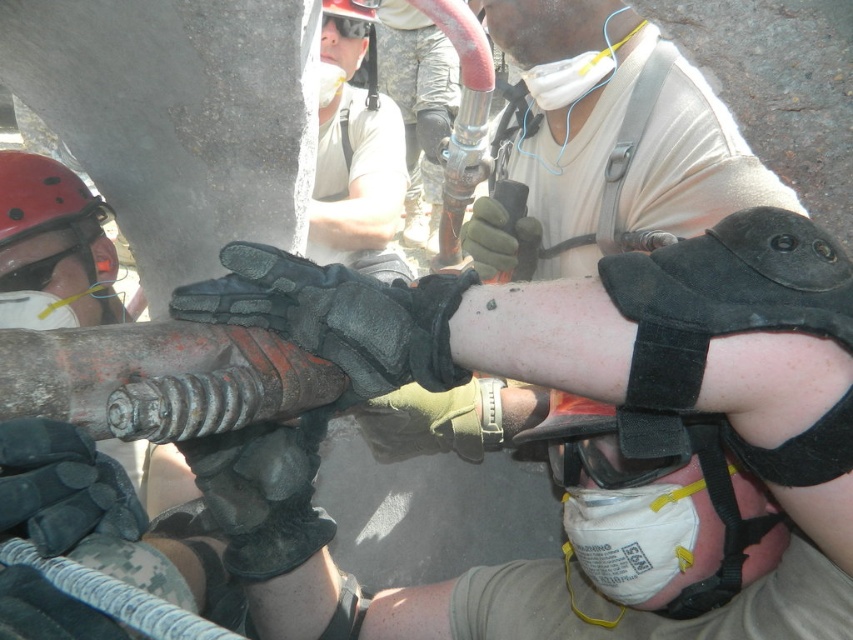
Which is behind, point (79, 276) or point (477, 250)?

The point (79, 276) is behind.

Between red matte helmet at left and black leather gloves at center, which one appears on the left side from the viewer's perspective?

red matte helmet at left is more to the left.

Is point (15, 154) closer to viewer compared to point (498, 209)?

No, it is behind (498, 209).

In order to click on red matte helmet at left in this screenshot , I will do `click(53, 248)`.